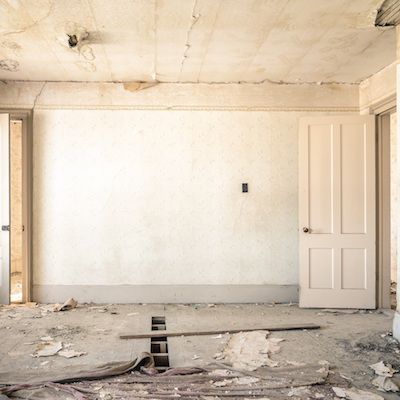
In order to click on doors in this screenshot , I will do `click(334, 253)`, `click(8, 208)`.